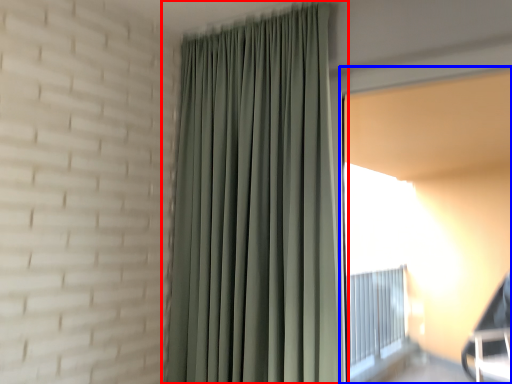
Question: Among these objects, which one is nearest to the camera, curtain (highlighted by a red box) or window screen (highlighted by a blue box)?

Choices:
 (A) curtain
 (B) window screen

Answer: (B)